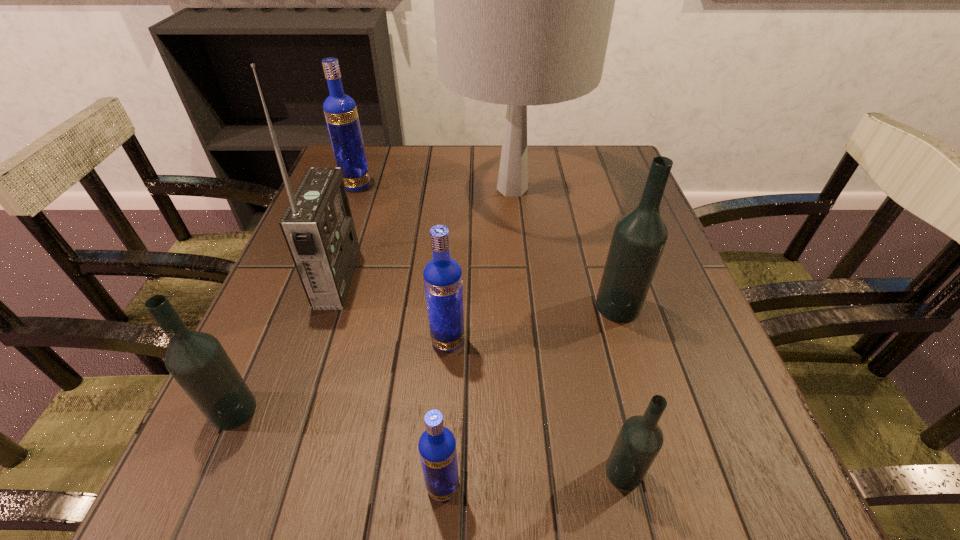
Identify the location of vacant region between the brown lampshade and the nearest black vodka. (567, 330).

Locate an element on the screen. free area in between the smallest black vodka and the farthest vodka is located at coordinates (490, 328).

Where is `free space between the second nearest blue vodka and the radio receiver`? free space between the second nearest blue vodka and the radio receiver is located at coordinates (393, 309).

The width and height of the screenshot is (960, 540). In order to click on unoccupied position between the radio receiver and the sixth farthest object in this screenshot , I will do `click(285, 344)`.

At what (x,y) coordinates should I click in order to perform the action: click on unoccupied area between the second smallest blue vodka and the farthest vodka. Please return your answer as a coordinate pair (x, y). The width and height of the screenshot is (960, 540). Looking at the image, I should click on (402, 263).

Select which object is the fourth closest to the biggest blue vodka. Please provide its 2D coordinates. Your answer should be formatted as a tuple, i.e. [(x, y)], where the tuple contains the x and y coordinates of a point satisfying the conditions above.

[(197, 361)]

Select which object appears as the fifth closest to the smallest blue vodka. Please provide its 2D coordinates. Your answer should be formatted as a tuple, i.e. [(x, y)], where the tuple contains the x and y coordinates of a point satisfying the conditions above.

[(639, 237)]

Locate which vodka is the fifth closest to the biggest black vodka. Please provide its 2D coordinates. Your answer should be formatted as a tuple, i.e. [(x, y)], where the tuple contains the x and y coordinates of a point satisfying the conditions above.

[(340, 110)]

Image resolution: width=960 pixels, height=540 pixels. What are the coordinates of `vodka that stands as the third closest to the nearest black vodka` in the screenshot? It's located at (442, 275).

Locate which blue vodka is the second closest to the fourth farthest vodka. Please provide its 2D coordinates. Your answer should be formatted as a tuple, i.e. [(x, y)], where the tuple contains the x and y coordinates of a point satisfying the conditions above.

[(437, 447)]